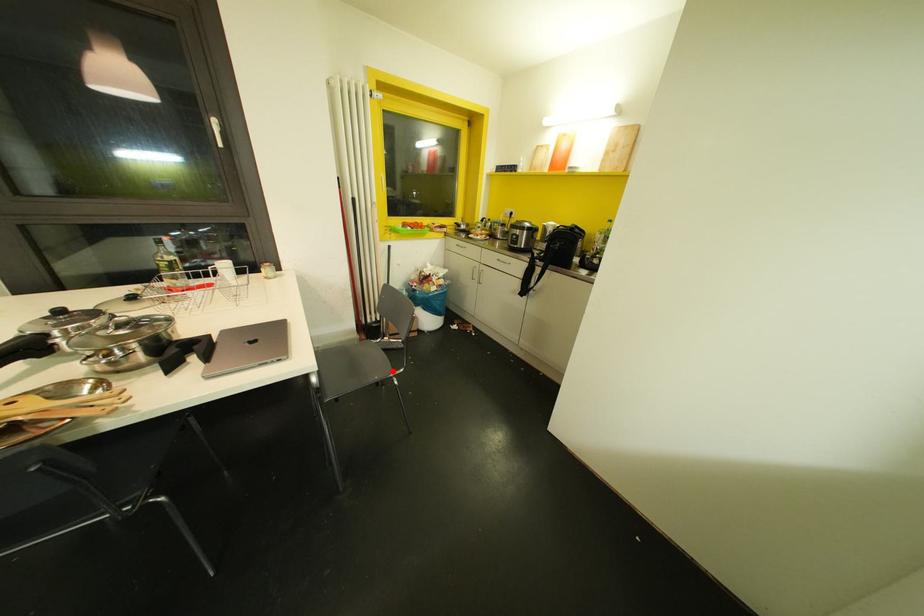
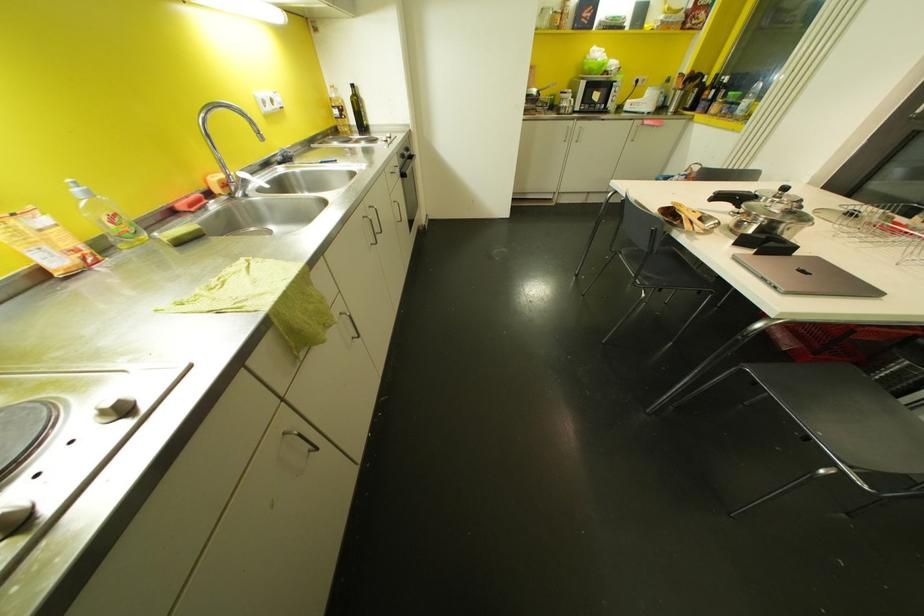
Find the pixel in the second image that matches the highlighted location in the first image.

(852, 467)